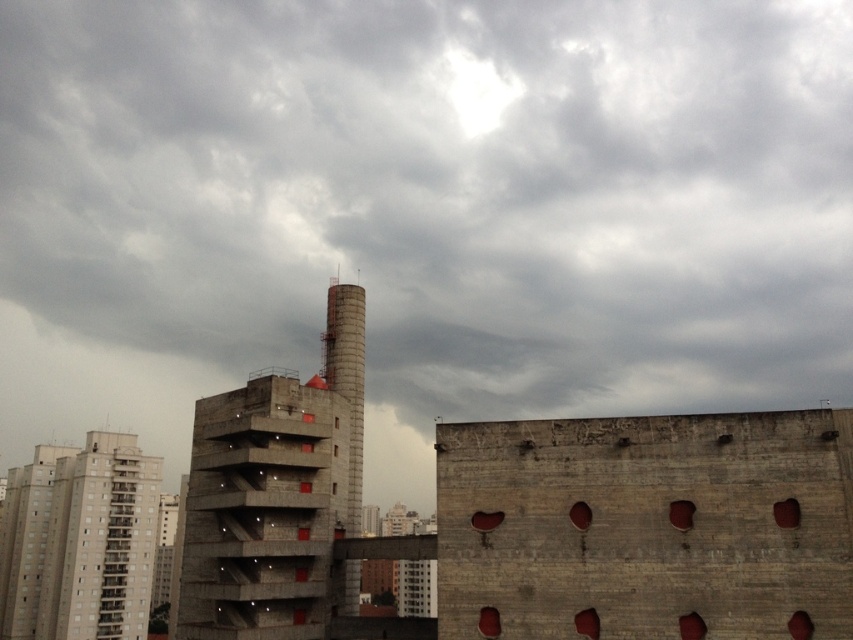
Where is `concrete building at center`? The width and height of the screenshot is (853, 640). concrete building at center is located at coordinates (526, 524).

Who is shorter, concrete building at center or gray concrete building at lower left?

gray concrete building at lower left

Where is `concrete building at center`? This screenshot has width=853, height=640. concrete building at center is located at coordinates (526, 524).

Is point (73, 618) farther from viewer compared to point (335, 340)?

Yes, it is.

Is gray concrete building at lower left closer to camera compared to smooth concrete chimney at center?

No, it is not.

The image size is (853, 640). Identify the location of gray concrete building at lower left. (79, 541).

Between gray concrete building at center and concrete building at center, which one appears on the left side from the viewer's perspective?

Positioned to the left is concrete building at center.

Which is more to the right, gray concrete building at center or concrete building at center?

Positioned to the right is gray concrete building at center.

Which is in front, point (430, 120) or point (683, 496)?

Point (683, 496) is more forward.

The width and height of the screenshot is (853, 640). What are the coordinates of `gray concrete building at center` in the screenshot? It's located at (444, 193).